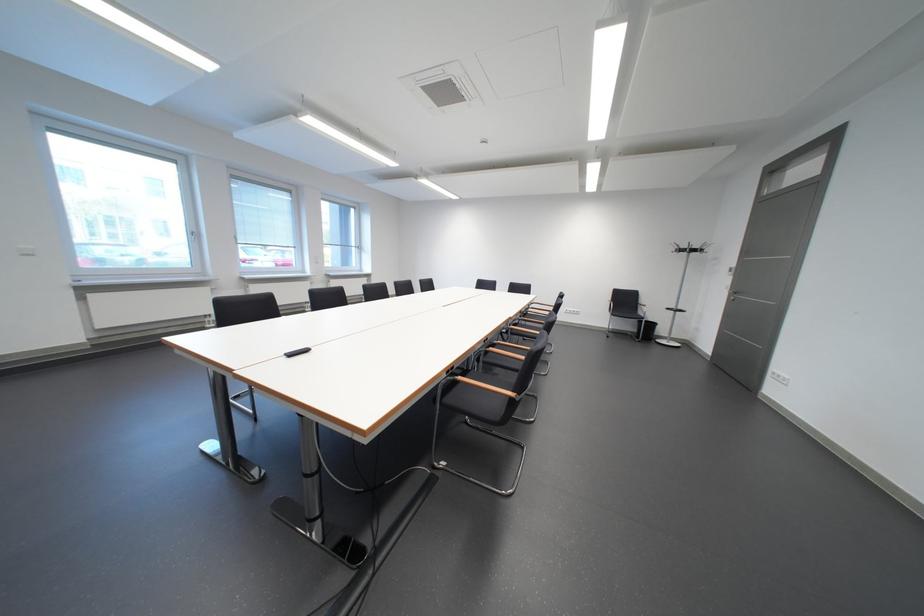
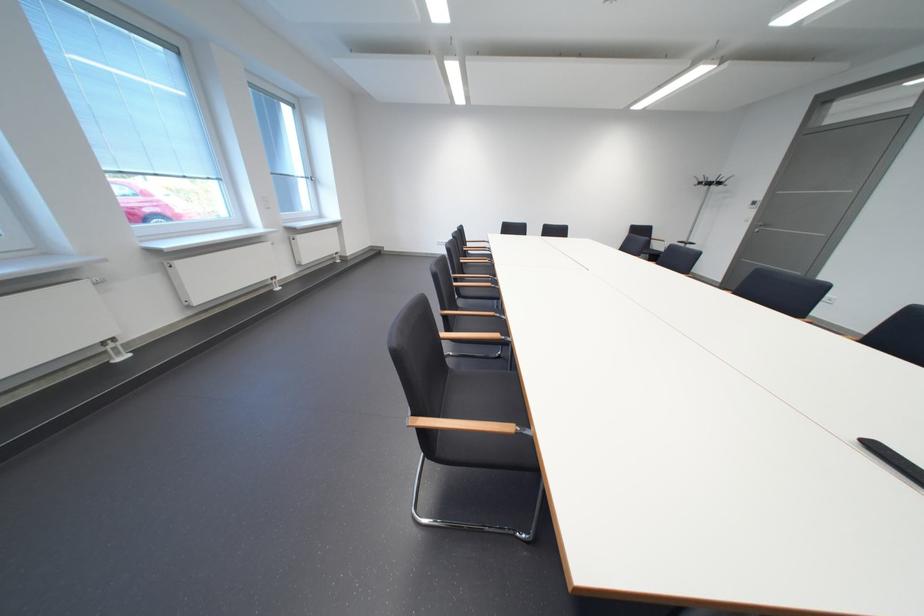
In a continuous first-person perspective shot, in which direction is the camera moving?

The cameraman moved toward left, forward.